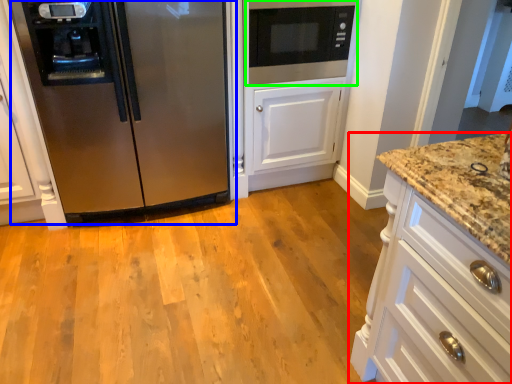
Question: Based on their relative distances, which object is farther from cabinetry (highlighted by a red box)? Choose from refrigerator (highlighted by a blue box) and microwave oven (highlighted by a green box).

Choices:
 (A) refrigerator
 (B) microwave oven

Answer: (A)